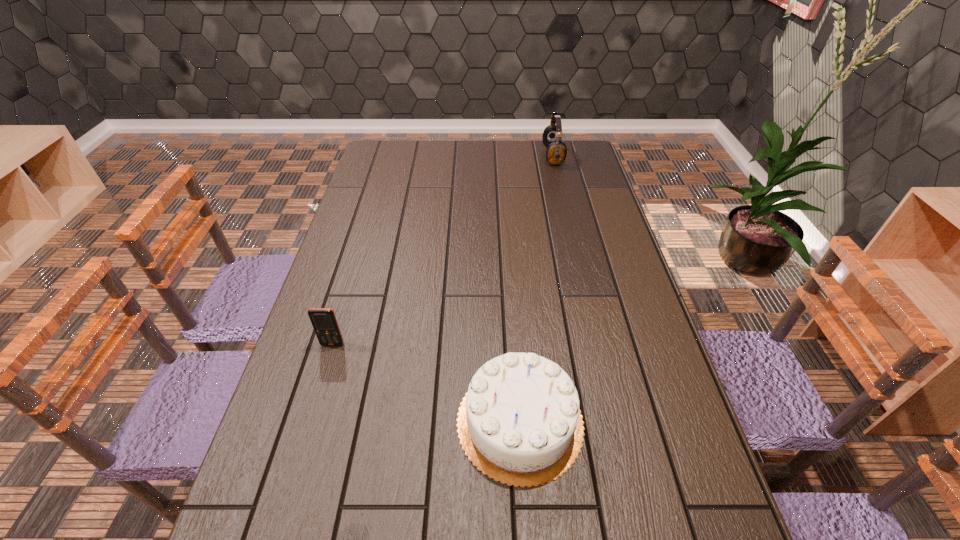
This screenshot has width=960, height=540. I want to click on the farthest object, so click(x=556, y=153).

You are a GUI agent. You are given a task and a screenshot of the screen. Output one action in this format:
    pyautogui.click(x=<x>, y=<y>)
    Task: Click on the rightmost object
    This screenshot has width=960, height=540.
    Given the screenshot: What is the action you would take?
    pyautogui.click(x=556, y=153)

The height and width of the screenshot is (540, 960). I want to click on birthday cake, so click(520, 423).

You are a GUI agent. You are given a task and a screenshot of the screen. Output one action in this format:
    pyautogui.click(x=<x>, y=<y>)
    Task: Click on the nearest object
    
    Given the screenshot: What is the action you would take?
    pyautogui.click(x=520, y=423)

Find the location of a particular element. This screenshot has height=540, width=960. cellular telephone is located at coordinates (324, 322).

Find the location of a particular element. The height and width of the screenshot is (540, 960). the shortest object is located at coordinates (324, 322).

Locate an element on the screen. vacant space situated 0.120m on the ear cups of the headset is located at coordinates coord(515,156).

Where is `free space located on the ear cups of the headset`? Image resolution: width=960 pixels, height=540 pixels. free space located on the ear cups of the headset is located at coordinates (495, 156).

In order to click on free location located on the ear cups of the headset in this screenshot , I will do `click(512, 156)`.

Where is `vacant space situated on the left of the second object from right to left`? The height and width of the screenshot is (540, 960). vacant space situated on the left of the second object from right to left is located at coordinates tap(393, 422).